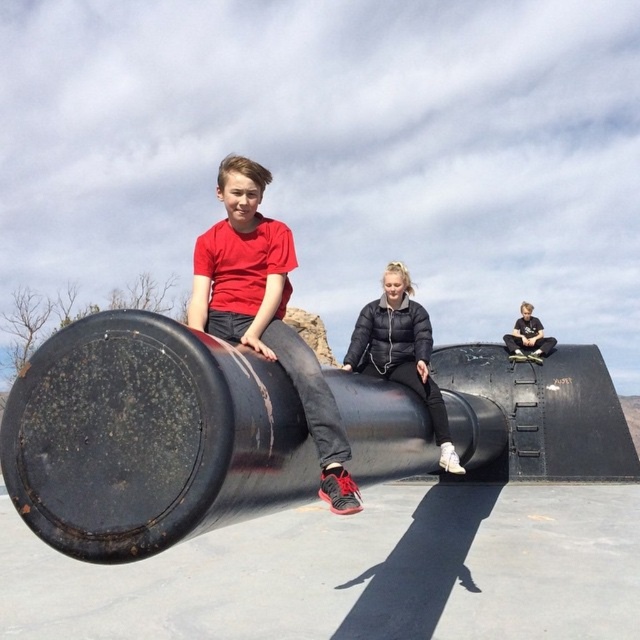
Question: Where is rusty metal cannon at center located in relation to matte black jacket at center in the image?

Choices:
 (A) above
 (B) below

Answer: (B)

Question: Which point appears closest to the camera in this image?

Choices:
 (A) (518, 337)
 (B) (227, 438)
 (C) (252, 244)

Answer: (B)

Question: Which point appears farthest from the camera in this image?

Choices:
 (A) (458, 392)
 (B) (264, 275)
 (C) (368, 362)
 (D) (518, 355)

Answer: (D)

Question: Which of the following is the farthest from the observer?

Choices:
 (A) matte black jacket at center
 (B) rusty metal cannon at center
 (C) black puffy jacket at center

Answer: (A)

Question: Is black puffy jacket at center further to camera compared to matte black jacket at center?

Choices:
 (A) no
 (B) yes

Answer: (A)

Question: Where is matte red shirt at center located in relation to matte black jacket at center in the image?

Choices:
 (A) above
 (B) below

Answer: (B)